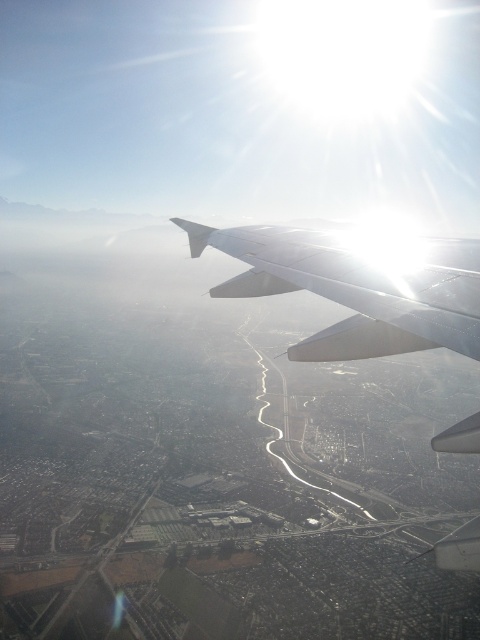
Question: From the image, what is the correct spatial relationship of white matte wing at upper center in relation to white glossy wing at upper center?

Choices:
 (A) left
 (B) right

Answer: (B)

Question: Can you confirm if white matte wing at upper center is wider than white glossy wing at upper center?

Choices:
 (A) no
 (B) yes

Answer: (B)

Question: Which of the following is the closest to the observer?

Choices:
 (A) white matte wing at upper center
 (B) white glossy wing at upper center

Answer: (B)

Question: Is white matte wing at upper center closer to the viewer compared to white glossy wing at upper center?

Choices:
 (A) no
 (B) yes

Answer: (A)